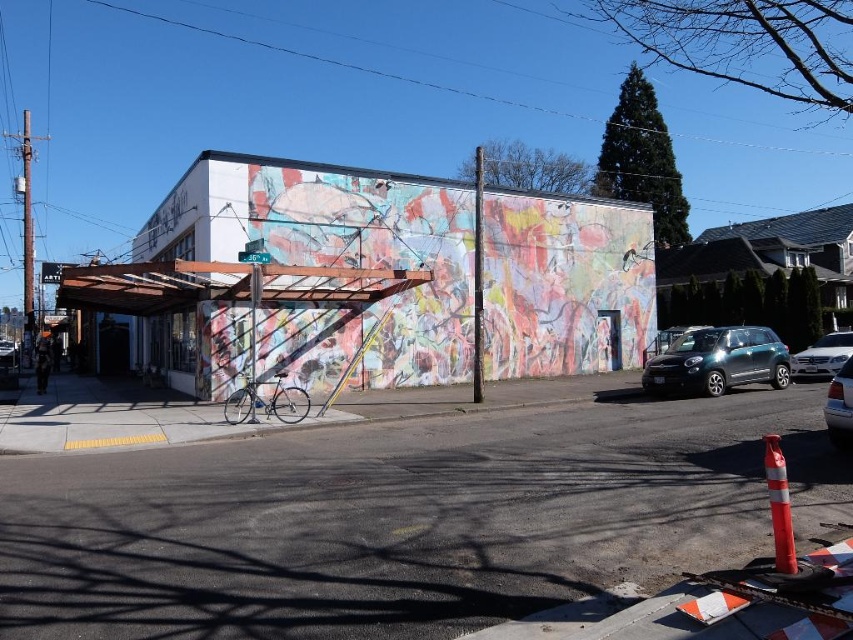
You are standing in the urban street scene and want to know which of the two points, point (711,352) or point (804,365), is closer to you. Can you determine this based on the scene?

Point (711,352) is closer to the viewer than point (804,365).

You are a parking attendant who needs to move the metallic silver sedan at right. Can you drive it out without moving the satin silver sedan at right?

The satin silver sedan at right is positioned over metallic silver sedan at right, so you cannot drive out the metallic silver sedan at right without first moving the satin silver sedan at right.

You are standing at the center of the image. Which direction should you walk to reach the shiny dark gray car at right?

You should walk to the right because the shiny dark gray car at right is located at point (718, 362), which is to the right of the center point.